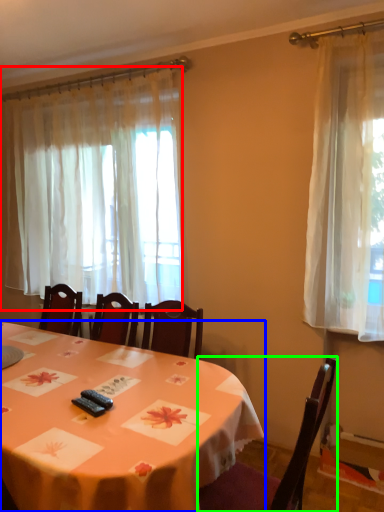
Question: Which object is positioned farthest from curtain (highlighted by a red box)? Select from table (highlighted by a blue box) and chair (highlighted by a green box).

Choices:
 (A) table
 (B) chair

Answer: (B)